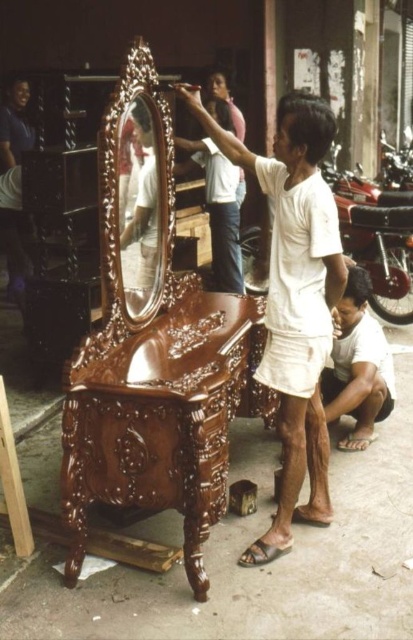
Can you confirm if white cotton shirt at center is smaller than polished wood mirror at center?

Incorrect, white cotton shirt at center is not smaller in size than polished wood mirror at center.

Based on the photo, is white cotton shirt at center further to camera compared to polished wood mirror at center?

No.

Describe the element at coordinates (294, 298) in the screenshot. I see `white cotton shirt at center` at that location.

Identify the location of white cotton shirt at center. Image resolution: width=413 pixels, height=640 pixels. (294, 298).

Find the location of `white cotton shirt at center`. white cotton shirt at center is located at coordinates (294, 298).

Is point (287, 138) behind point (220, 179)?

No.

Find the location of a particular element. This screenshot has height=640, width=413. white cotton shirt at center is located at coordinates (294, 298).

Is shiny brown wood vanity at center wider than polished wood mirror at center?

Indeed, shiny brown wood vanity at center has a greater width compared to polished wood mirror at center.

Is shiny brown wood vanity at center taller than polished wood mirror at center?

Yes.

The width and height of the screenshot is (413, 640). What do you see at coordinates (161, 413) in the screenshot? I see `shiny brown wood vanity at center` at bounding box center [161, 413].

The height and width of the screenshot is (640, 413). Identify the location of shiny brown wood vanity at center. click(161, 413).